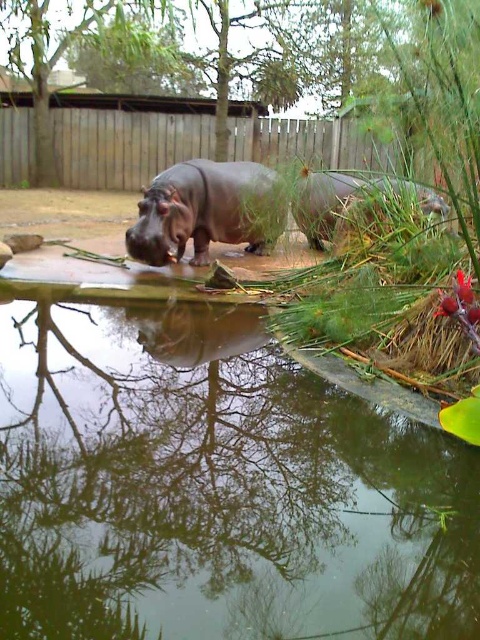
You are a zookeeper planning to clean the enclosure. You need to know which area takes up more space between the green reflective water at center and the brown matte rhinoceros at right. Which one is larger?

The brown matte rhinoceros at right occupies more space than the green reflective water at center according to the description.

You are a zookeeper trying to locate the brown matte rhinoceros at right in the enclosure. From the green reflective water at center, which direction should you look to find it?

The brown matte rhinoceros at right is located to the right of the green reflective water at center, so you should look to the right side of the water to find it.

You are standing in the zoo enclosure and want to find the green reflective water at center. According to the coordinates given, where should you look? Please provide the coordinates in the format of a point like point (231, 497).

The green reflective water at center is located at point (231, 497).